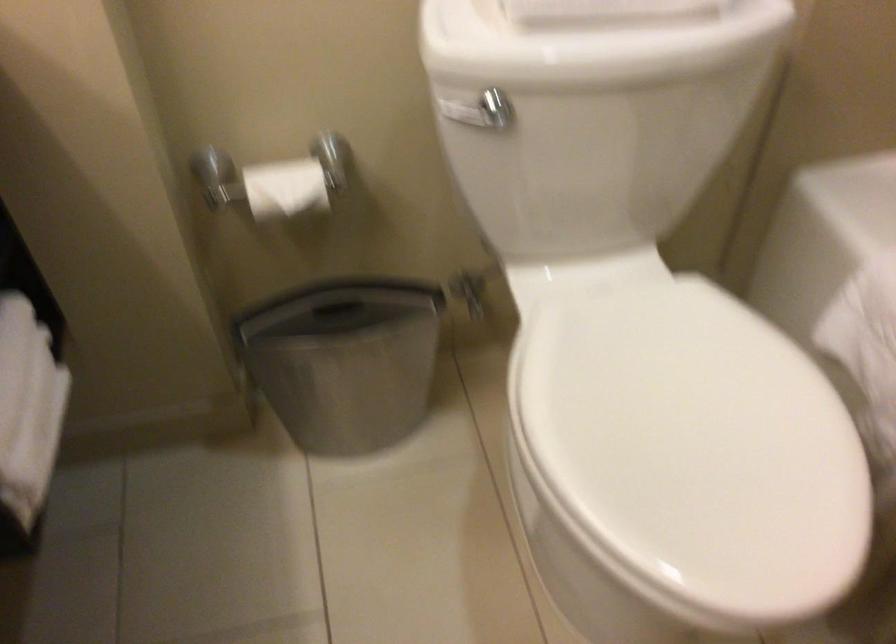
Based on the continuous images, in which direction is the camera rotating?

The camera rotated toward left-down.